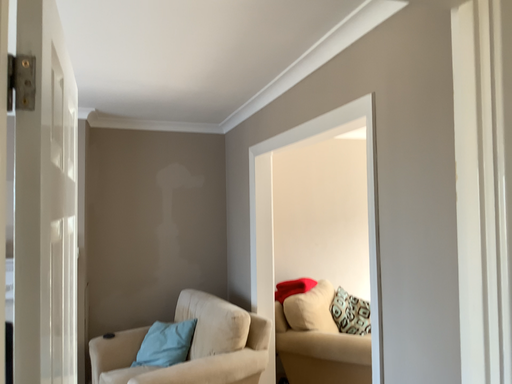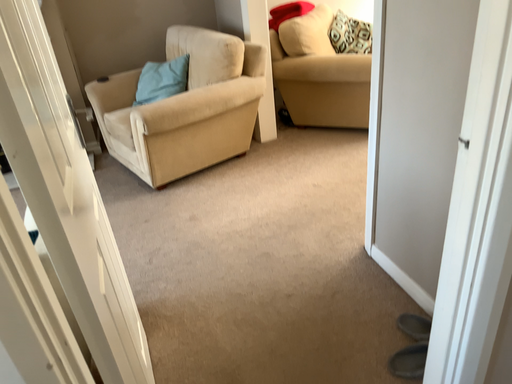
Question: How did the camera likely rotate when shooting the video?

Choices:
 (A) rotated upward
 (B) rotated downward

Answer: (B)